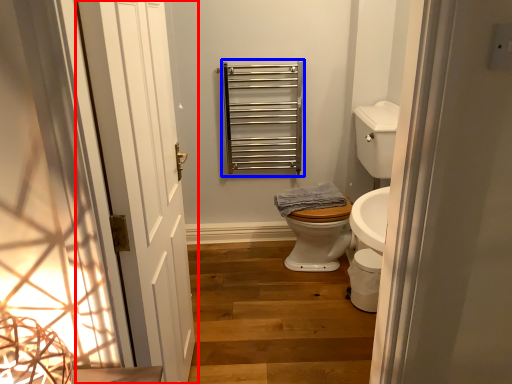
Question: Which point is further to the camera, door (highlighted by a red box) or balustrade (highlighted by a blue box)?

Choices:
 (A) door
 (B) balustrade

Answer: (B)